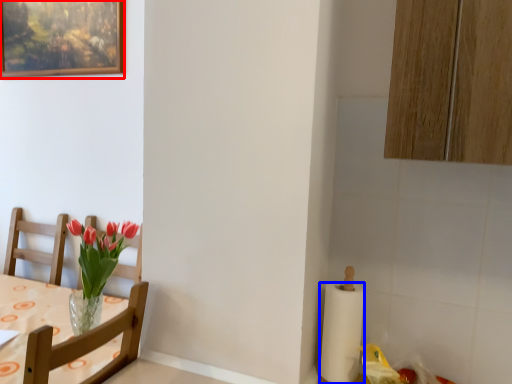
Question: Which object appears farthest to the camera in this image, picture frame (highlighted by a red box) or paper towel (highlighted by a blue box)?

Choices:
 (A) picture frame
 (B) paper towel

Answer: (A)